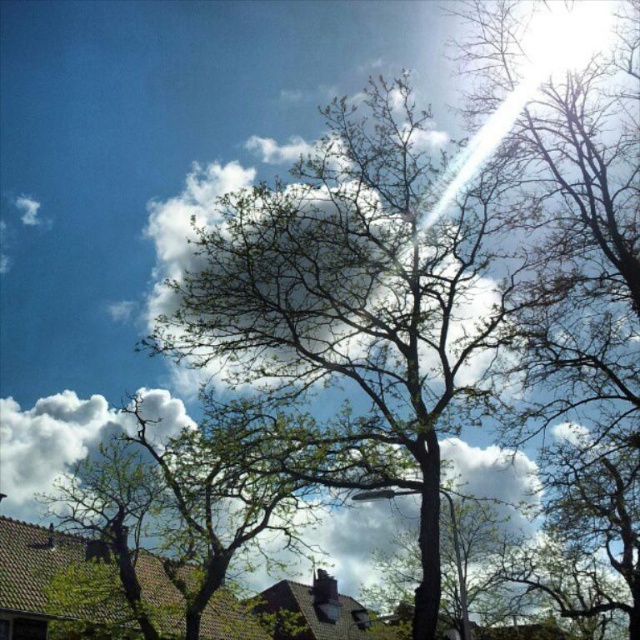
You are an artist trying to paint the scene. You want to ensure the green leafy tree at center and the white fluffy cloud at upper left are proportionally accurate. Which object should you make smaller in your painting?

The green leafy tree at center should be made smaller in the painting because it occupies less space than the white fluffy cloud at upper left according to the description.

In the scene shown: You are standing in the outdoor scene and want to take a photo of both point (330, 332) and point (157, 442). Which point should you focus on first to ensure both are in clear view?

You should focus on point (330, 332) first because it is closer to the camera than point (157, 442), ensuring both points are in focus when using depth of field.